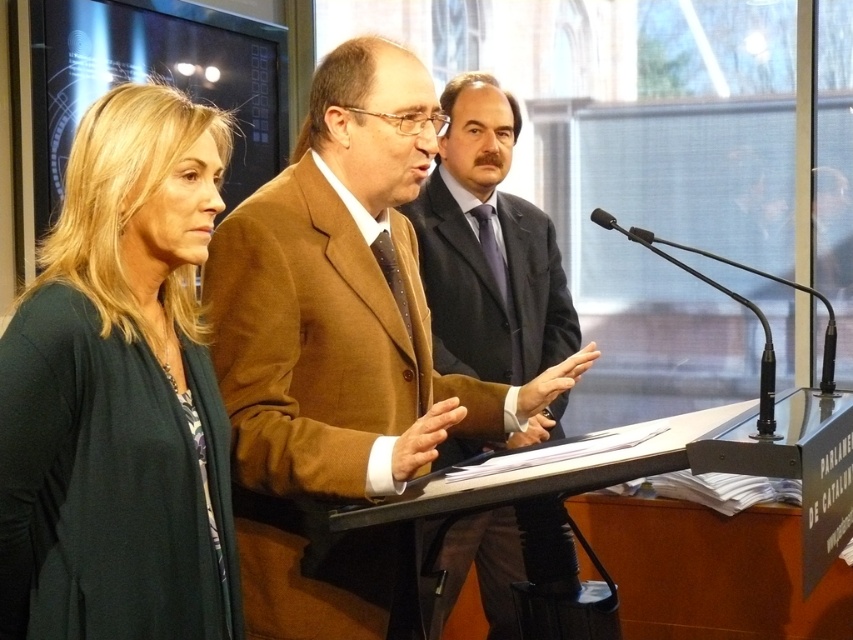
Question: Is brown woolen suit at center positioned before brown woolen coat at center?

Choices:
 (A) no
 (B) yes

Answer: (B)

Question: Which point is farther to the camera?

Choices:
 (A) brown woolen suit at center
 (B) brown woolen coat at center
 (C) dark green sweater at left

Answer: (B)

Question: Is dark green sweater at left positioned before brown woolen coat at center?

Choices:
 (A) yes
 (B) no

Answer: (A)

Question: Does brown woolen suit at center appear on the right side of brown woolen coat at center?

Choices:
 (A) no
 (B) yes

Answer: (A)

Question: Estimate the real-world distances between objects in this image. Which object is closer to the dark green sweater at left?

Choices:
 (A) black plastic microphone at center
 (B) brown woolen coat at center
 (C) brown woolen suit at center

Answer: (C)

Question: Which object is farther from the camera taking this photo?

Choices:
 (A) black plastic microphone at center
 (B) brown woolen suit at center

Answer: (A)